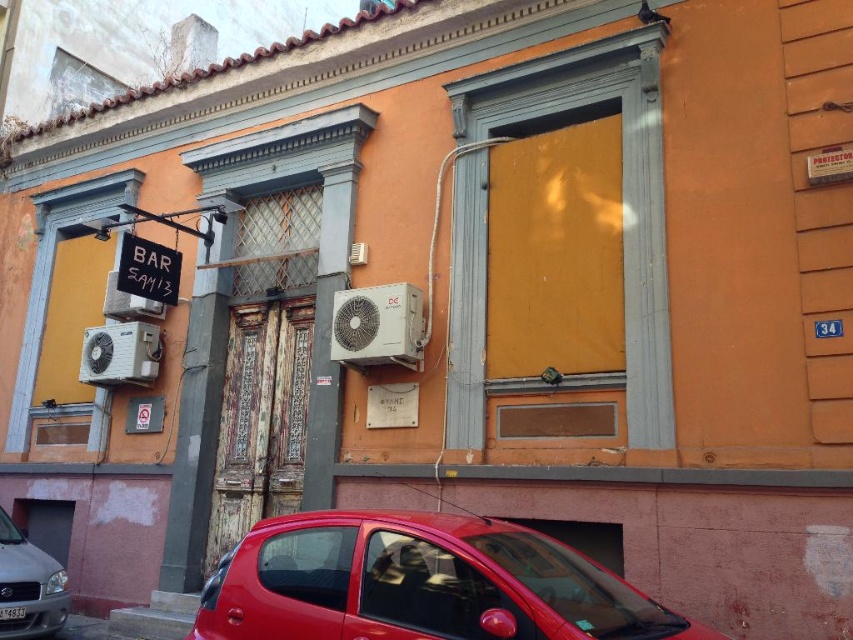
Which is above, glossy red car at lower center or white metallic air conditioner at lower left?

white metallic air conditioner at lower left

Where is `glossy red car at lower center`? glossy red car at lower center is located at coordinates (421, 582).

Is point (624, 618) closer to viewer compared to point (154, 349)?

That is True.

The width and height of the screenshot is (853, 640). Find the location of `glossy red car at lower center`. glossy red car at lower center is located at coordinates (421, 582).

Can you confirm if glossy red car at lower center is wider than white metallic air conditioner at center?

Indeed, glossy red car at lower center has a greater width compared to white metallic air conditioner at center.

Is point (376, 520) positioned after point (358, 296)?

No, it is in front of (358, 296).

The width and height of the screenshot is (853, 640). I want to click on glossy red car at lower center, so click(x=421, y=582).

Does white metallic air conditioner at lower left have a greater width compared to white metallic air conditioner at upper left?

Indeed, white metallic air conditioner at lower left has a greater width compared to white metallic air conditioner at upper left.

Is white metallic air conditioner at lower left further to camera compared to white metallic air conditioner at upper left?

No, white metallic air conditioner at lower left is closer to the viewer.

Who is more distant from viewer, (136, 355) or (126, 292)?

The point (126, 292) is behind.

The width and height of the screenshot is (853, 640). Identify the location of white metallic air conditioner at lower left. (120, 353).